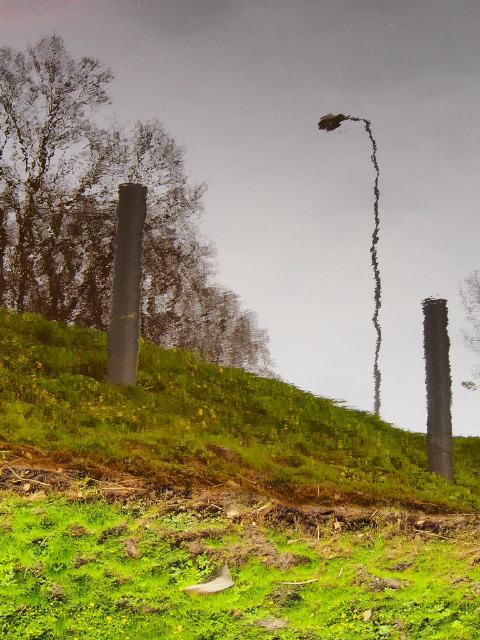
Question: Which point appears farthest from the camera in this image?

Choices:
 (A) (440, 326)
 (B) (375, 397)

Answer: (B)

Question: Which object is farther from the camera taking this photo?

Choices:
 (A) green mossy ground at lower center
 (B) green grassy hillside at center
 (C) smooth gray pole at right

Answer: (C)

Question: Which point appears farthest from the camera in this image?

Choices:
 (A) (240, 532)
 (B) (144, 177)
 (C) (130, 320)
 (D) (214, 380)

Answer: (B)

Question: Can you confirm if smooth black pole at left is positioned to the right of smooth black pole at center?

Choices:
 (A) no
 (B) yes

Answer: (A)

Question: Does smooth black pole at left have a lesser width compared to smooth gray pole at right?

Choices:
 (A) yes
 (B) no

Answer: (B)

Question: Can you confirm if green grassy hillside at center is wider than rusty metal pole at center?

Choices:
 (A) yes
 (B) no

Answer: (B)